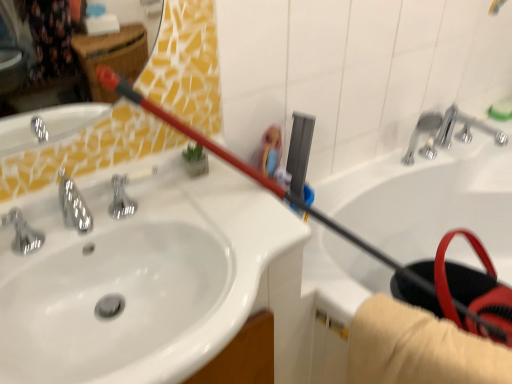
Question: Is silver metallic faucet at left thinner than white glossy sink at upper left?

Choices:
 (A) yes
 (B) no

Answer: (A)

Question: Can you confirm if silver metallic faucet at left is bigger than white glossy sink at upper left?

Choices:
 (A) yes
 (B) no

Answer: (B)

Question: Is silver metallic faucet at left positioned in front of white glossy sink at upper left?

Choices:
 (A) yes
 (B) no

Answer: (B)

Question: Is silver metallic faucet at left far from white glossy sink at upper left?

Choices:
 (A) no
 (B) yes

Answer: (A)

Question: From the image's perspective, is silver metallic faucet at left located beneath white glossy sink at upper left?

Choices:
 (A) yes
 (B) no

Answer: (B)

Question: Considering the relative positions of silver metallic faucet at left and white glossy sink at upper left in the image provided, is silver metallic faucet at left behind white glossy sink at upper left?

Choices:
 (A) yes
 (B) no

Answer: (A)

Question: Is silver metallic faucet at left a part of white glossy bathtub at upper right?

Choices:
 (A) no
 (B) yes

Answer: (A)

Question: Is white glossy bathtub at upper right oriented towards silver metallic faucet at left?

Choices:
 (A) yes
 (B) no

Answer: (A)

Question: Can you confirm if white glossy bathtub at upper right is smaller than silver metallic faucet at left?

Choices:
 (A) yes
 (B) no

Answer: (B)

Question: Can you confirm if white glossy bathtub at upper right is shorter than silver metallic faucet at left?

Choices:
 (A) yes
 (B) no

Answer: (B)

Question: Is white glossy bathtub at upper right beside silver metallic faucet at left?

Choices:
 (A) yes
 (B) no

Answer: (B)

Question: Is white glossy bathtub at upper right positioned with its back to silver metallic faucet at left?

Choices:
 (A) no
 (B) yes

Answer: (A)

Question: Is silver metallic faucet at upper right, the second plumbing fixture from the left, completely or partially outside of white glossy sink at upper left?

Choices:
 (A) no
 (B) yes

Answer: (B)